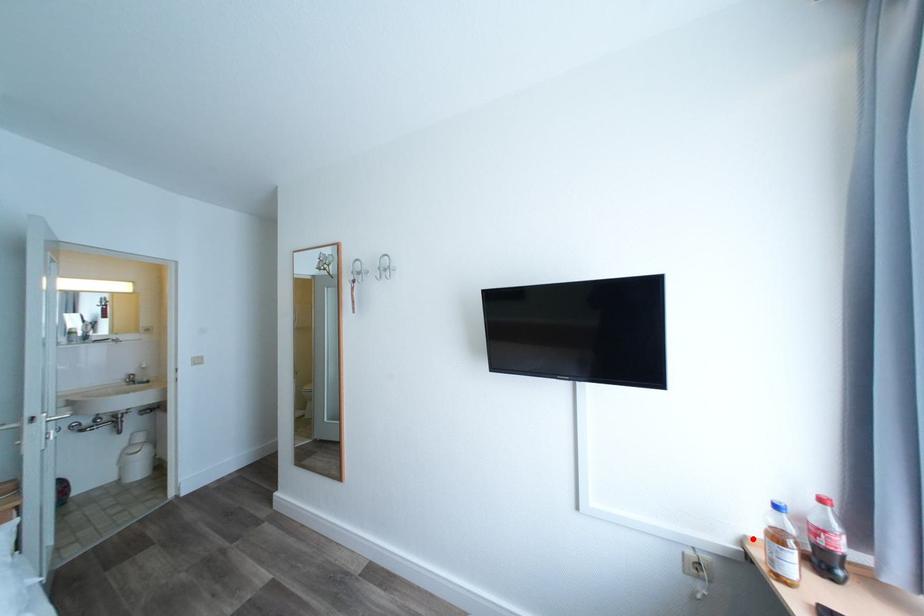
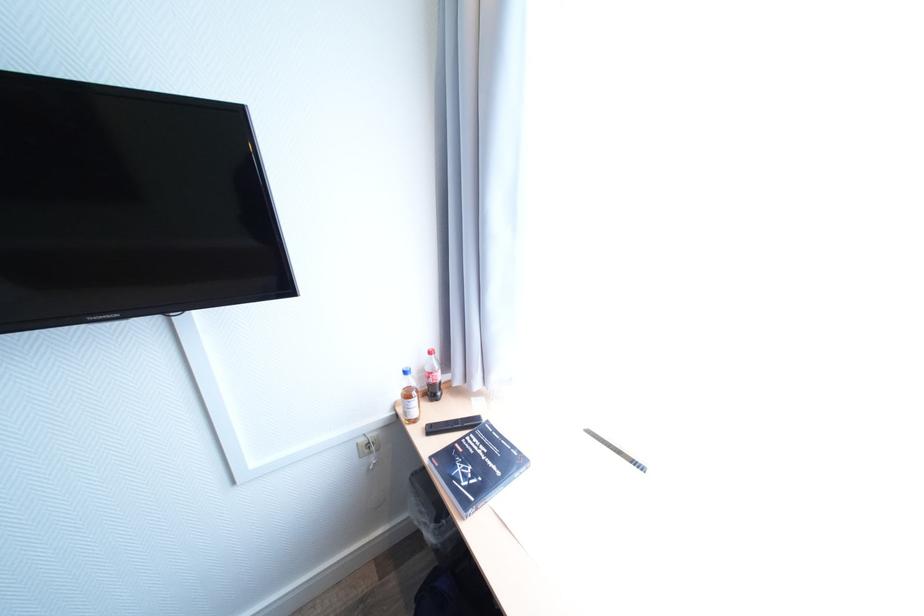
Question: I am providing you with two images of the same scene from different viewpoints. In image1, a red point is highlighted. Considering the same 3D point in image2, which of the following is correct?

Choices:
 (A) It is closer
 (B) It is farther

Answer: (B)